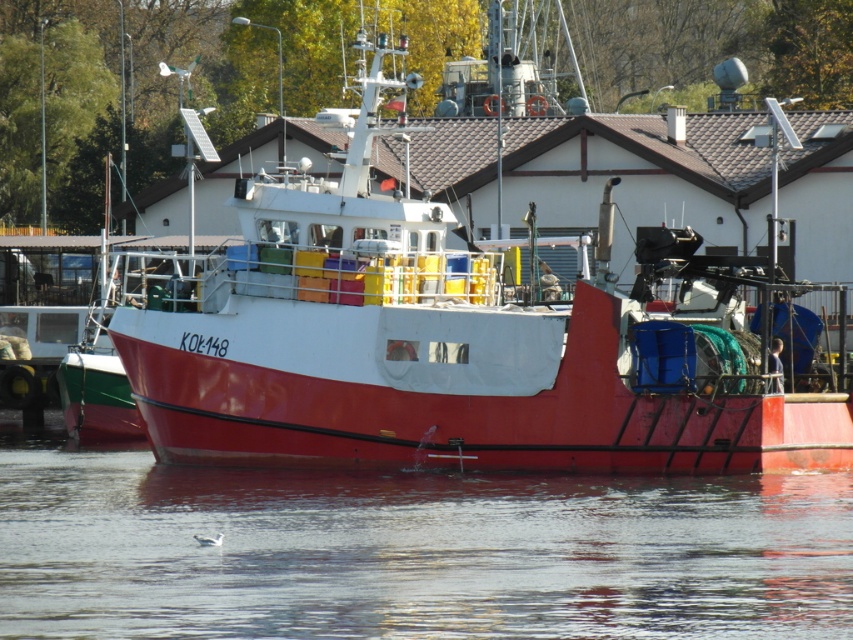
Between point (672, 390) and point (181, 531), which one is positioned in front?

Point (181, 531) is in front.

Can you confirm if red matte boat at center is bigger than transparent water at lower center?

Yes, red matte boat at center is bigger than transparent water at lower center.

Which is behind, point (178, 376) or point (173, 576)?

The point (178, 376) is more distant.

Identify the location of red matte boat at center. The width and height of the screenshot is (853, 640). (457, 342).